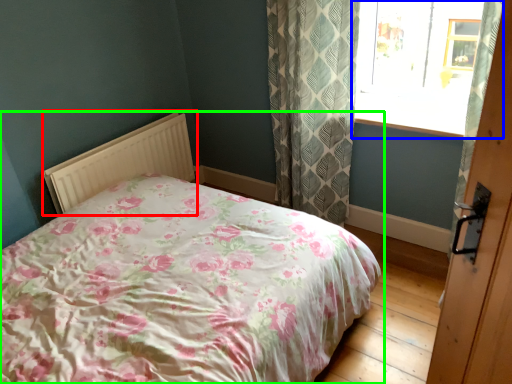
Question: Based on their relative distances, which object is nearer to radiator (highlighted by a red box)? Choose from window (highlighted by a blue box) and bed (highlighted by a green box).

Choices:
 (A) window
 (B) bed

Answer: (B)